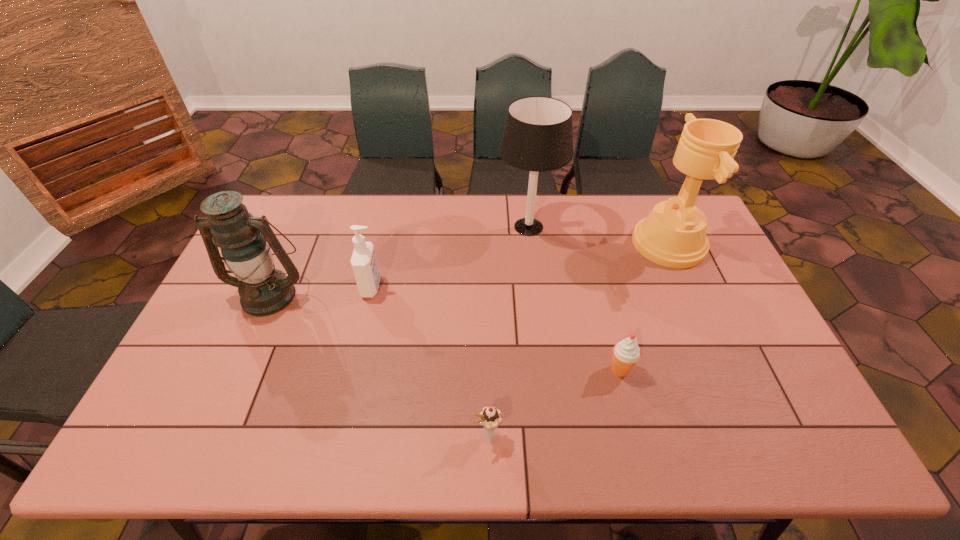
Locate an element on the screen. table lamp is located at coordinates (538, 136).

Where is `award`? award is located at coordinates (673, 235).

The image size is (960, 540). Identify the location of the leftmost object. (263, 291).

Locate an element on the screen. This screenshot has width=960, height=540. the fourth tallest object is located at coordinates (364, 264).

This screenshot has width=960, height=540. I want to click on cleansing agent, so click(x=364, y=264).

Find the location of a particular element. Image resolution: width=960 pixels, height=540 pixels. the farther icecream is located at coordinates (626, 353).

Identify the location of the fifth object from left to right. (626, 353).

I want to click on the left icecream, so click(490, 417).

Locate an element on the screen. the nearer icecream is located at coordinates (490, 417).

Locate an element on the screen. Image resolution: width=960 pixels, height=540 pixels. free space located on the right of the table lamp is located at coordinates (660, 227).